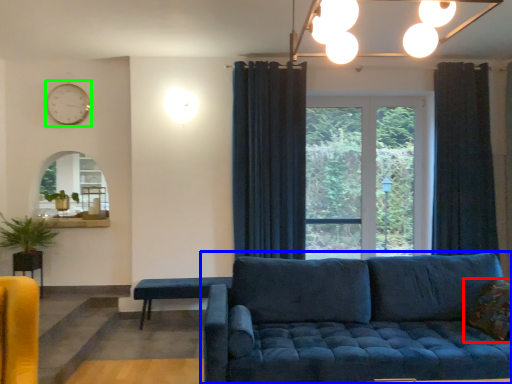
Question: Considering the real-world distances, which object is farthest from pillow (highlighted by a red box)? studio couch (highlighted by a blue box) or clock (highlighted by a green box)?

Choices:
 (A) studio couch
 (B) clock

Answer: (B)